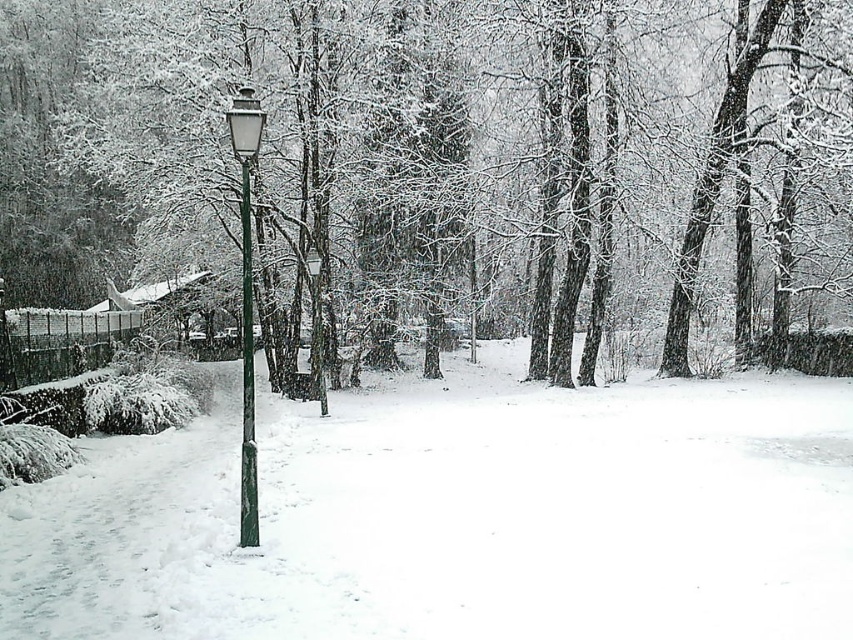
Question: Which point is closer to the camera?

Choices:
 (A) (244, 518)
 (B) (230, 138)
 (C) (701, 536)

Answer: (A)

Question: Which of the following is the farthest from the observer?

Choices:
 (A) green metallic pole at center
 (B) snow-covered tree at center
 (C) white fluffy snow at center
 (D) green matte lamp post at left

Answer: (B)

Question: Is snow-covered tree at center smaller than green metallic pole at center?

Choices:
 (A) no
 (B) yes

Answer: (A)

Question: Is snow-covered tree at center closer to camera compared to white fluffy snow at center?

Choices:
 (A) no
 (B) yes

Answer: (A)

Question: Is snow-covered tree at center below green matte lamp post at left?

Choices:
 (A) no
 (B) yes

Answer: (A)

Question: Which is farther from the green matte lamp post at left?

Choices:
 (A) snow-covered tree at center
 (B) green metallic pole at center
 (C) white fluffy snow at center

Answer: (A)